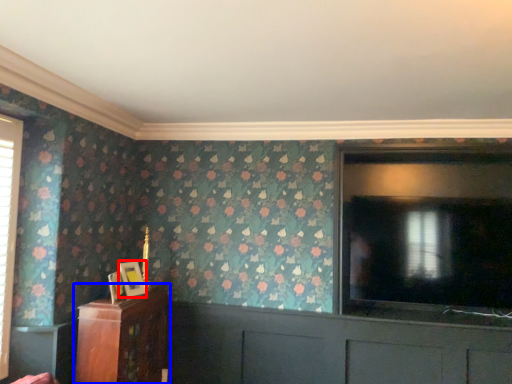
Question: Which point is further to the camera, picture frame (highlighted by a red box) or furniture (highlighted by a blue box)?

Choices:
 (A) picture frame
 (B) furniture

Answer: (A)